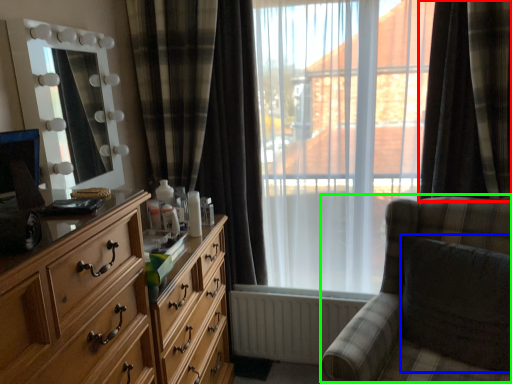
Question: Based on their relative distances, which object is nearer to curtain (highlighted by a red box)? Choose from swivel chair (highlighted by a blue box) and rocking chair (highlighted by a green box).

Choices:
 (A) swivel chair
 (B) rocking chair

Answer: (B)